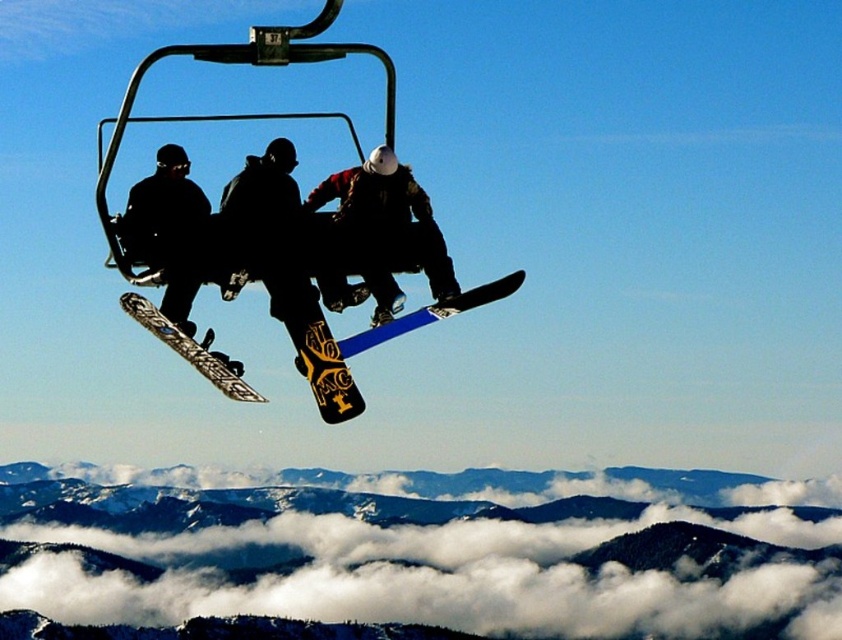
You are planning to take a photo of the snowy forested mountain at lower center and the yellow matte snowboard at center from the ski lift. Which object will appear taller in the photo?

The snowy forested mountain at lower center will appear taller in the photo because it has a greater height compared to the yellow matte snowboard at center.

You are standing on the ski lift and looking at two points in the scene. The first point is at coordinates point (429, 225) and the second is at point (515, 280). Which point is closer to you?

Point (429, 225) is closer to you because it is further to the viewer than point (515, 280).

You are a photographer standing on the ski lift and want to take a photo of the yellow matte snowboard at center and the blue matte snowboard at center. Which one is positioned higher in the scene?

The yellow matte snowboard at center is positioned higher than the blue matte snowboard at center.